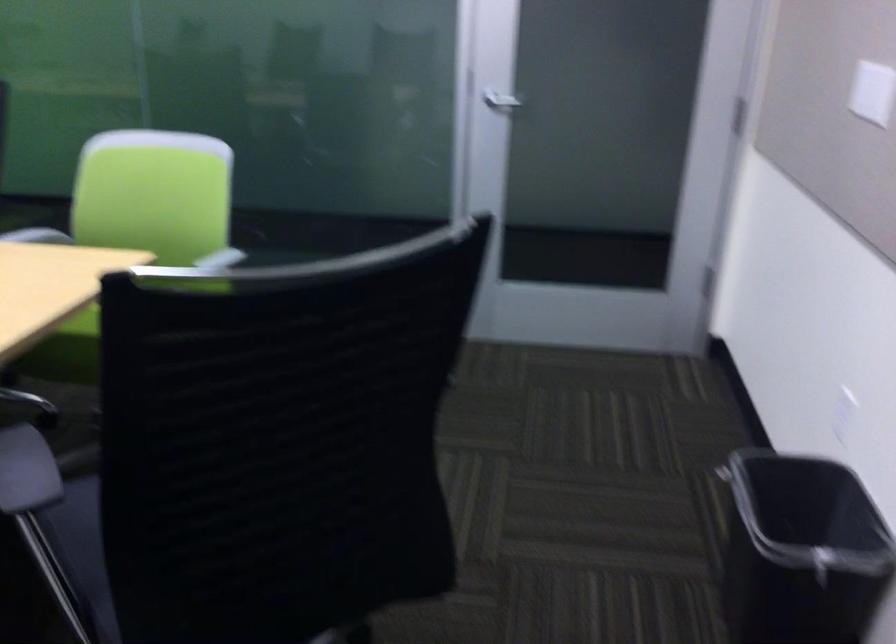
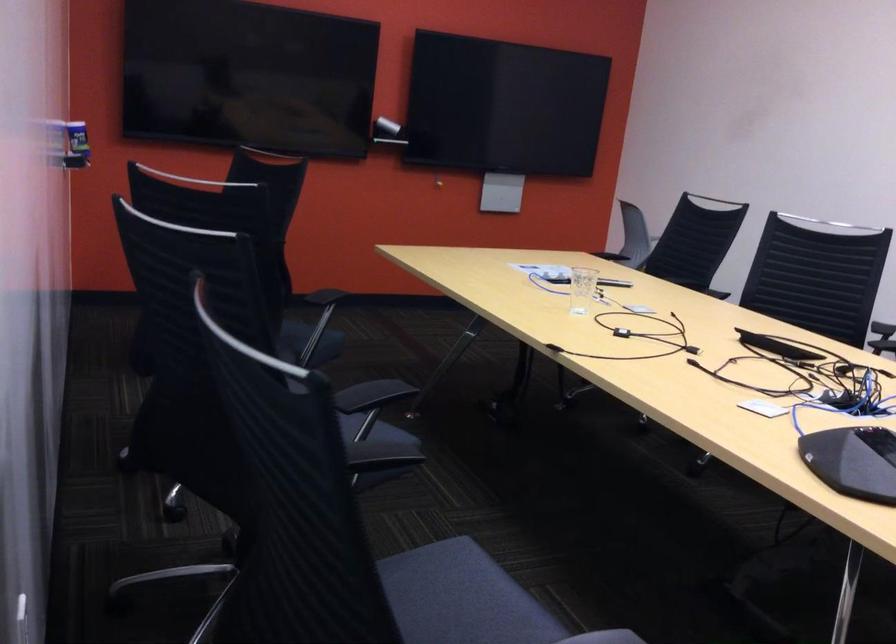
Question: The camera is either moving clockwise (left) or counter-clockwise (right) around the object. The first image is from the beginning of the video and the second image is from the end. Is the camera moving left or right when shooting the video?

Choices:
 (A) Left
 (B) Right

Answer: (B)